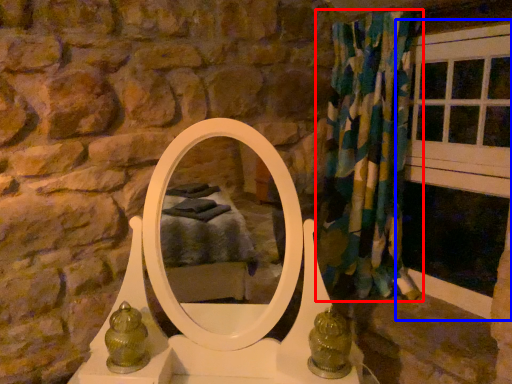
Question: Which point is further to the camera, curtain (highlighted by a red box) or window frame (highlighted by a blue box)?

Choices:
 (A) curtain
 (B) window frame

Answer: (A)